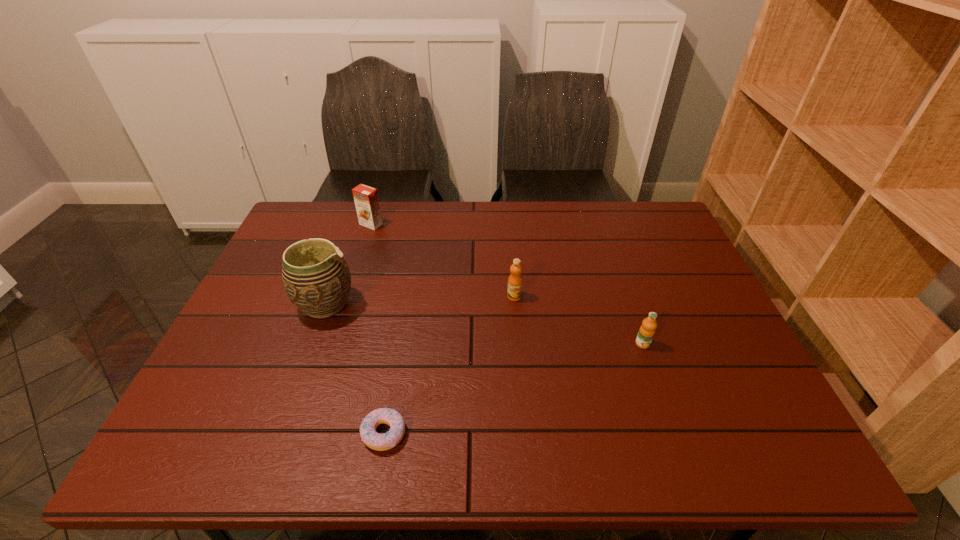
The image size is (960, 540). Find the location of `free space located 0.130m on the right of the farthest orange juice`. free space located 0.130m on the right of the farthest orange juice is located at coordinates (421, 224).

Where is `vacant space located on the front label of the second object from right to left`? The width and height of the screenshot is (960, 540). vacant space located on the front label of the second object from right to left is located at coordinates pyautogui.click(x=521, y=375).

At what (x,y) coordinates should I click in order to perform the action: click on blank area located on the label of the rightmost object. Please return your answer as a coordinate pair (x, y). Looking at the image, I should click on (684, 462).

This screenshot has width=960, height=540. Identify the location of free region located 0.160m on the back of the third object from left to right. (397, 354).

I want to click on object that is at the far edge, so click(x=366, y=200).

This screenshot has height=540, width=960. I want to click on object that is at the near edge, so click(381, 442).

Locate an element on the screen. object that is at the left edge is located at coordinates (316, 278).

In the image, there is a desktop. Where is `vacant space at the far edge`? This screenshot has width=960, height=540. vacant space at the far edge is located at coordinates (396, 219).

This screenshot has width=960, height=540. In the image, there is a desktop. In order to click on free space at the near edge in this screenshot , I will do `click(595, 433)`.

Where is `free region at the left edge of the desktop`? The image size is (960, 540). free region at the left edge of the desktop is located at coordinates (237, 377).